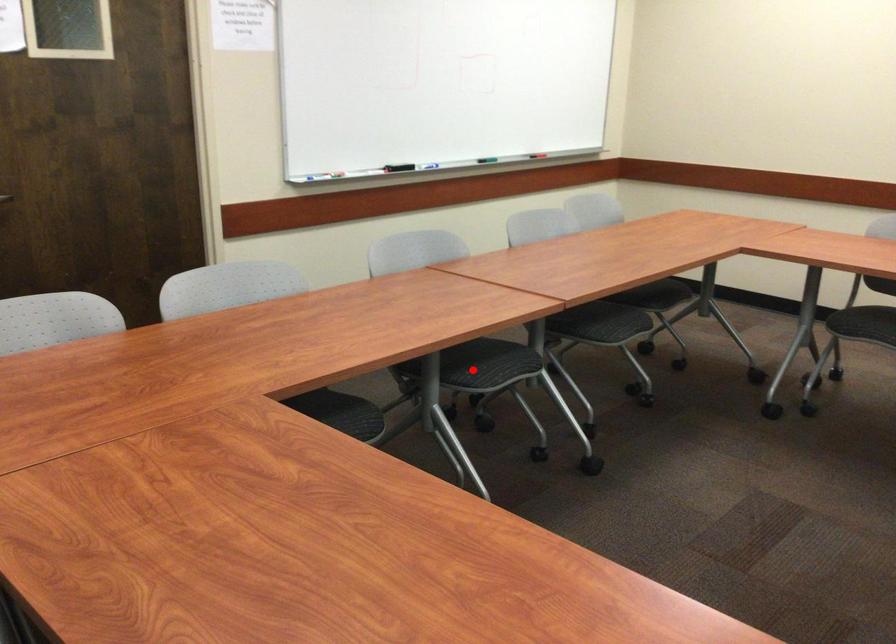
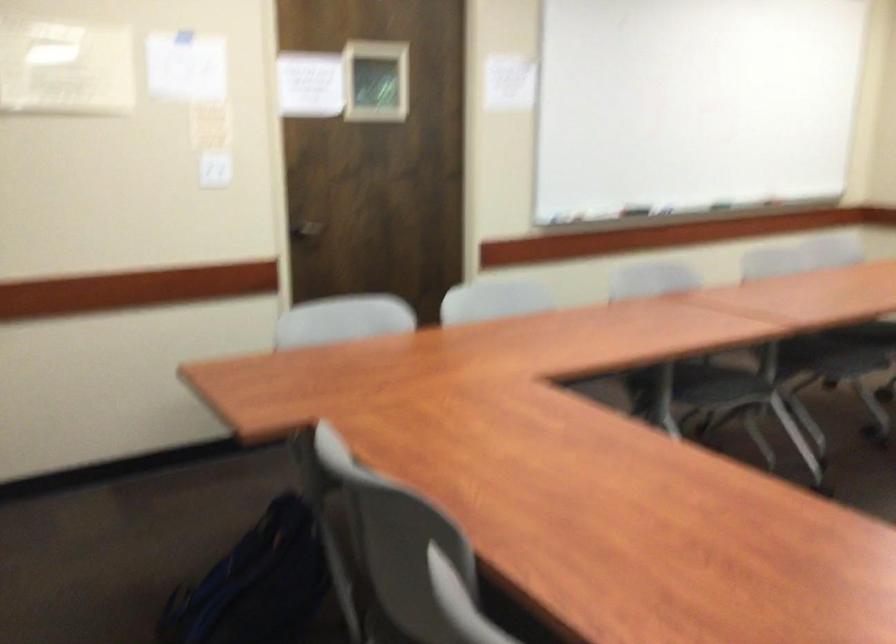
Find the pixel in the second image that matches the highlighted location in the first image.

(712, 386)